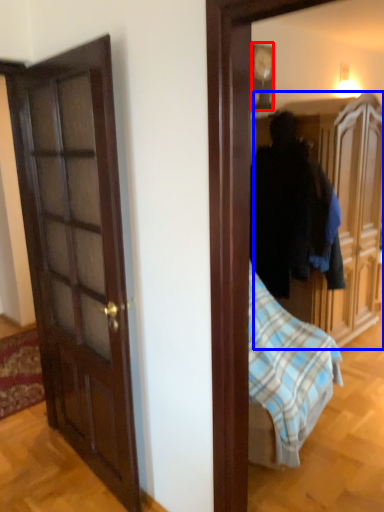
Question: Which object appears farthest to the camera in this image, picture frame (highlighted by a red box) or cabinetry (highlighted by a blue box)?

Choices:
 (A) picture frame
 (B) cabinetry

Answer: (A)